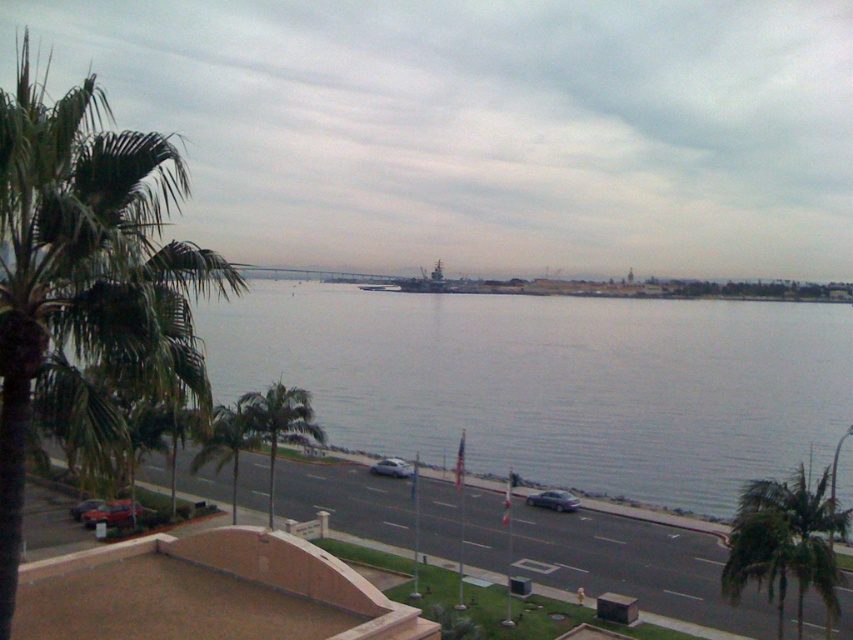
Does gray water at center have a smaller size compared to green leafy palm tree at left?

Indeed, gray water at center has a smaller size compared to green leafy palm tree at left.

Is gray water at center to the right of green leafy palm tree at left from the viewer's perspective?

Yes, gray water at center is to the right of green leafy palm tree at left.

At what (x,y) coordinates should I click in order to perform the action: click on gray water at center. Please return your answer as a coordinate pair (x, y). The width and height of the screenshot is (853, 640). Looking at the image, I should click on (553, 381).

I want to click on gray water at center, so click(x=553, y=381).

Does green leafy palm tree at lower right have a lesser height compared to green leafy palm tree at lower center?

In fact, green leafy palm tree at lower right may be taller than green leafy palm tree at lower center.

Based on the photo, between green leafy palm tree at lower right and green leafy palm tree at lower center, which one has more height?

Standing taller between the two is green leafy palm tree at lower right.

This screenshot has height=640, width=853. What do you see at coordinates (784, 541) in the screenshot?
I see `green leafy palm tree at lower right` at bounding box center [784, 541].

Where is `green leafy palm tree at lower right`? The image size is (853, 640). green leafy palm tree at lower right is located at coordinates (784, 541).

Between green leafy palm tree at left and satin silver sedan at lower center, which one has less height?

satin silver sedan at lower center is shorter.

At what (x,y) coordinates should I click in order to perform the action: click on green leafy palm tree at left. Please return your answer as a coordinate pair (x, y). The width and height of the screenshot is (853, 640). Looking at the image, I should click on (85, 266).

I want to click on green leafy palm tree at left, so click(85, 266).